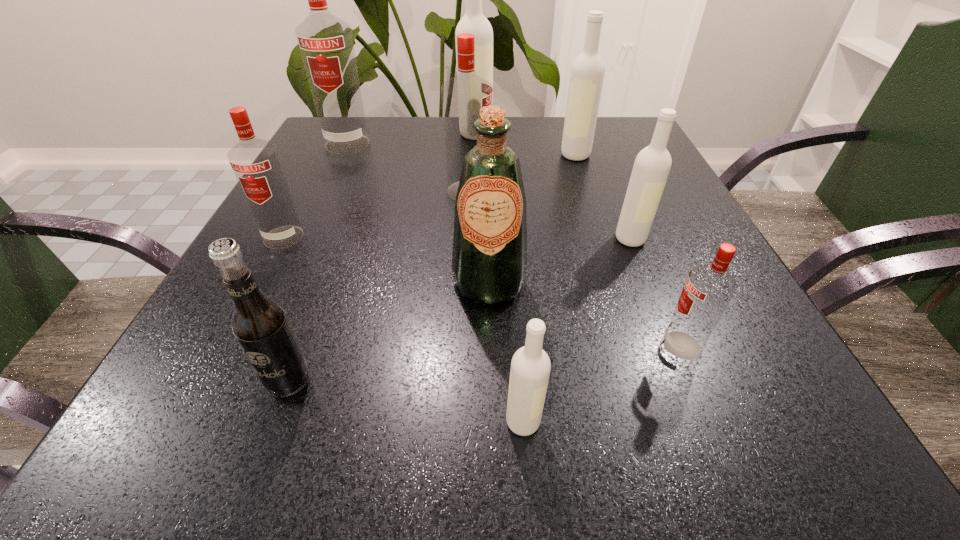
Find the location of a particular element. white vodka object that ranks as the third closest to the farthest red vodka is located at coordinates (651, 168).

Where is `white vodka identified as the fourth closest to the smallest red vodka`? The image size is (960, 540). white vodka identified as the fourth closest to the smallest red vodka is located at coordinates (474, 22).

Image resolution: width=960 pixels, height=540 pixels. What are the coordinates of `the fourth closest red vodka relative to the seventh farthest object` in the screenshot? It's located at (325, 41).

What are the coordinates of `red vodka object that ranks as the second closest to the nearest vodka` in the screenshot? It's located at (462, 96).

Locate an element on the screen. This screenshot has width=960, height=540. vacant space that satisfies the following two spatial constraints: 1. on the front label of the fourth vodka from right to left; 2. on the right side of the second smallest red vodka is located at coordinates (186, 422).

Where is `free location that satisfies the following two spatial constraints: 1. on the front side of the leftmost white vodka; 2. on the left side of the third smallest white vodka`? The image size is (960, 540). free location that satisfies the following two spatial constraints: 1. on the front side of the leftmost white vodka; 2. on the left side of the third smallest white vodka is located at coordinates (475, 154).

The image size is (960, 540). Identify the location of free space that satisfies the following two spatial constraints: 1. on the back side of the nearest white vodka; 2. on the left side of the third biggest white vodka. (509, 239).